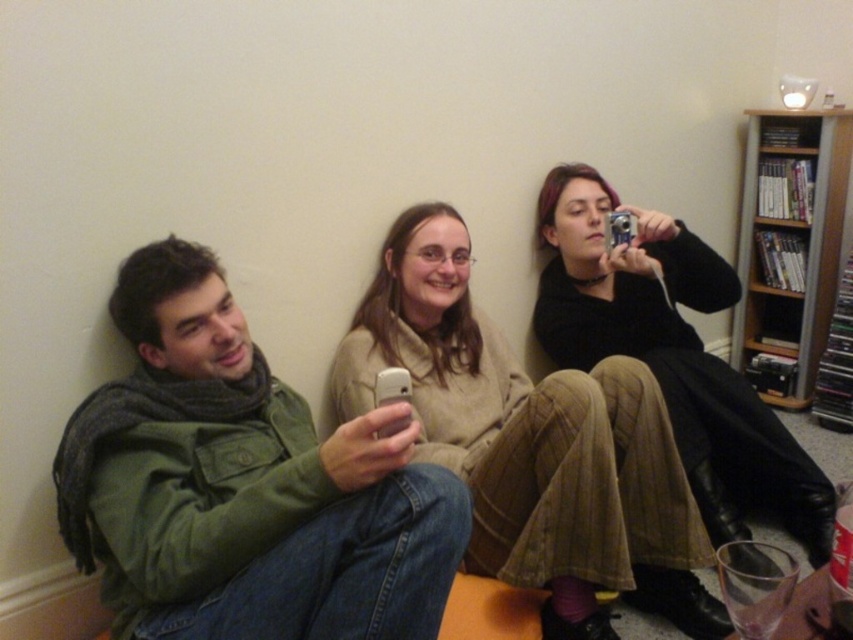
Question: Considering the relative positions of beige corduroy pants at center and wooden bookshelf at upper right in the image provided, where is beige corduroy pants at center located with respect to wooden bookshelf at upper right?

Choices:
 (A) right
 (B) left

Answer: (B)

Question: Among these objects, which one is nearest to the camera?

Choices:
 (A) matte black camera at center
 (B) beige corduroy pants at center
 (C) matte green jacket at left

Answer: (C)

Question: Can you confirm if matte green jacket at left is positioned above wooden bookshelf at upper right?

Choices:
 (A) no
 (B) yes

Answer: (A)

Question: Based on their relative distances, which object is farther from the matte green jacket at left?

Choices:
 (A) matte black camera at center
 (B) beige corduroy pants at center

Answer: (A)

Question: Can you confirm if matte green jacket at left is positioned to the right of beige corduroy pants at center?

Choices:
 (A) yes
 (B) no

Answer: (B)

Question: Which object is closer to the camera taking this photo?

Choices:
 (A) beige corduroy pants at center
 (B) matte black camera at center
 (C) matte green jacket at left

Answer: (C)